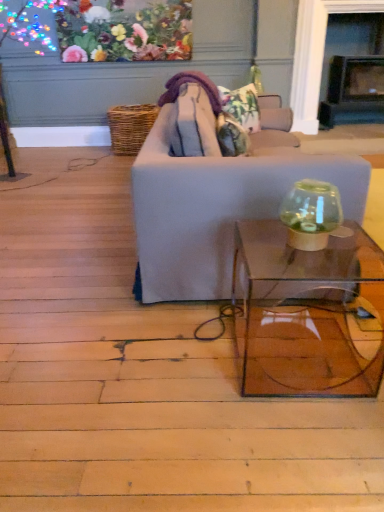
Question: Does floral fabric pillow at center appear on the right side of transparent glass table at center?

Choices:
 (A) yes
 (B) no

Answer: (B)

Question: From a real-world perspective, is floral fabric pillow at center positioned under transparent glass table at center based on gravity?

Choices:
 (A) no
 (B) yes

Answer: (A)

Question: Is floral fabric pillow at center in contact with transparent glass table at center?

Choices:
 (A) yes
 (B) no

Answer: (B)

Question: Can you confirm if floral fabric pillow at center is positioned to the left of transparent glass table at center?

Choices:
 (A) no
 (B) yes

Answer: (B)

Question: Does floral fabric pillow at center lie behind transparent glass table at center?

Choices:
 (A) no
 (B) yes

Answer: (B)

Question: Considering the relative sizes of floral fabric pillow at center and transparent glass table at center in the image provided, is floral fabric pillow at center taller than transparent glass table at center?

Choices:
 (A) yes
 (B) no

Answer: (B)

Question: Is light gray fabric couch at center in contact with transparent glass table at center?

Choices:
 (A) no
 (B) yes

Answer: (A)

Question: Is light gray fabric couch at center to the left of transparent glass table at center from the viewer's perspective?

Choices:
 (A) yes
 (B) no

Answer: (A)

Question: Does light gray fabric couch at center have a lesser width compared to transparent glass table at center?

Choices:
 (A) no
 (B) yes

Answer: (A)

Question: Considering the relative sizes of light gray fabric couch at center and transparent glass table at center in the image provided, is light gray fabric couch at center shorter than transparent glass table at center?

Choices:
 (A) no
 (B) yes

Answer: (A)

Question: Considering the relative positions of light gray fabric couch at center and transparent glass table at center in the image provided, is light gray fabric couch at center in front of transparent glass table at center?

Choices:
 (A) no
 (B) yes

Answer: (A)

Question: Can you confirm if light gray fabric couch at center is bigger than transparent glass table at center?

Choices:
 (A) yes
 (B) no

Answer: (A)

Question: Are transparent glass fishbowl at right and light gray fabric couch at center located far from each other?

Choices:
 (A) yes
 (B) no

Answer: (B)